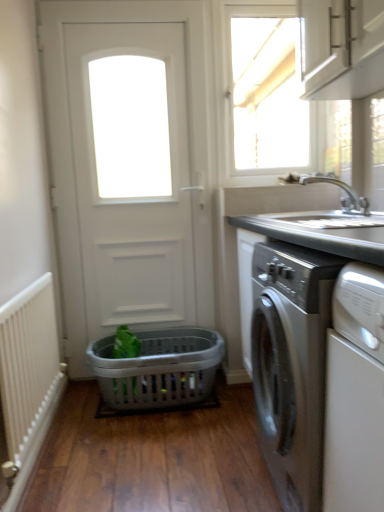
Where is `vacant space underneath white textured radiator at left (from a real-world perspective)`? vacant space underneath white textured radiator at left (from a real-world perspective) is located at coordinates (38, 467).